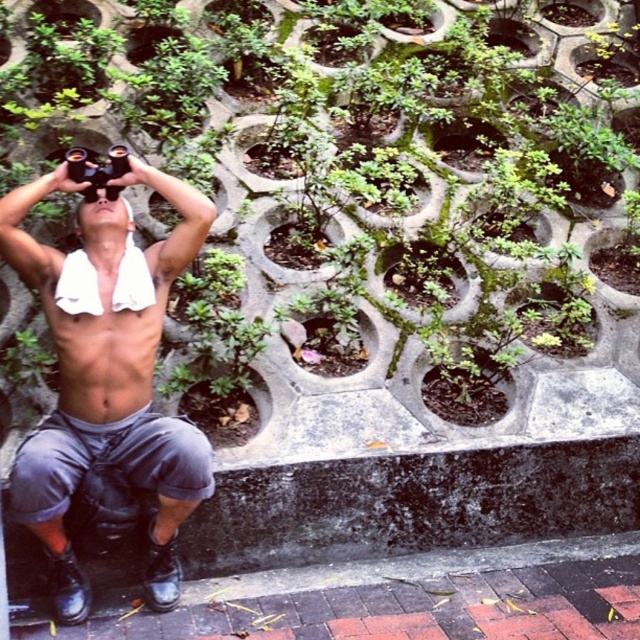
Question: Which object is closer to the camera taking this photo?

Choices:
 (A) green leafy plant at center
 (B) shiny black binoculars at upper center

Answer: (B)

Question: Is green leafy plant at center below shiny black binoculars at upper center?

Choices:
 (A) no
 (B) yes

Answer: (A)

Question: Is green leafy plant at center smaller than shiny black binoculars at upper center?

Choices:
 (A) no
 (B) yes

Answer: (A)

Question: Which point is closer to the camera?

Choices:
 (A) shiny black binoculars at upper center
 (B) green leafy plant at center

Answer: (A)

Question: Is green leafy plant at center thinner than shiny black binoculars at upper center?

Choices:
 (A) yes
 (B) no

Answer: (B)